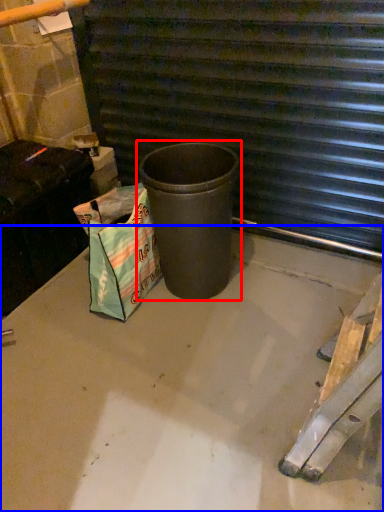
Question: Among these objects, which one is farthest to the camera, waste container (highlighted by a red box) or concrete (highlighted by a blue box)?

Choices:
 (A) waste container
 (B) concrete

Answer: (A)